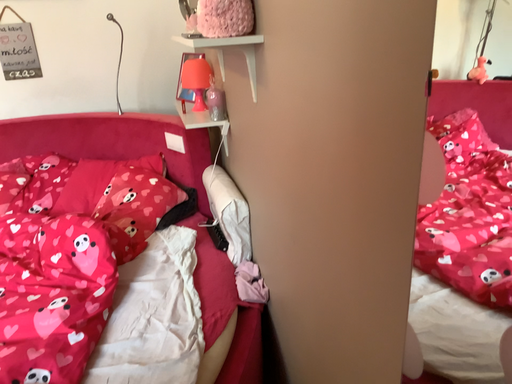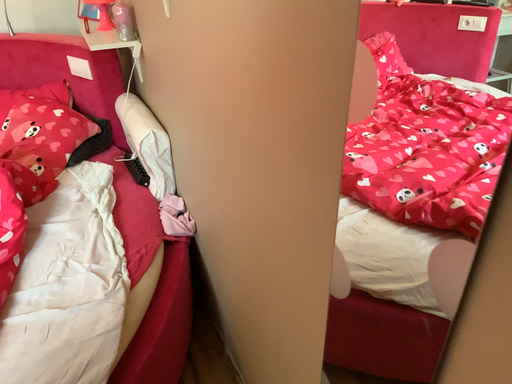
Question: How did the camera likely rotate when shooting the video?

Choices:
 (A) rotated downward
 (B) rotated upward

Answer: (A)